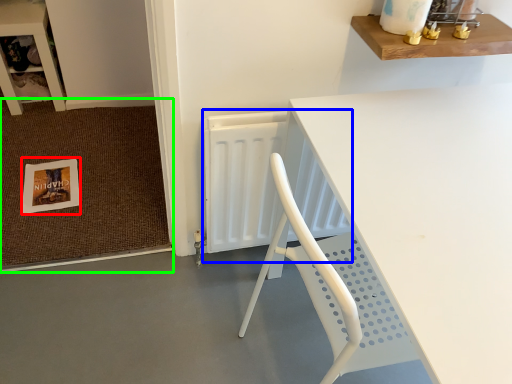
Question: Considering the real-world distances, which object is closest to postcard (highlighted by a red box)? radiator (highlighted by a blue box) or doormat (highlighted by a green box).

Choices:
 (A) radiator
 (B) doormat

Answer: (B)